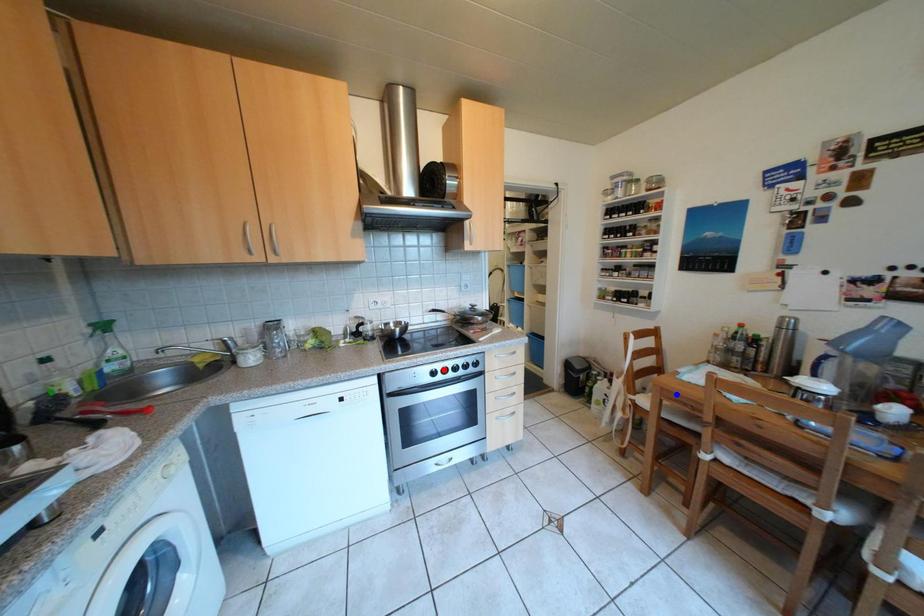
Order these from farthest to nearest:
blue point
green point
red point

blue point → red point → green point